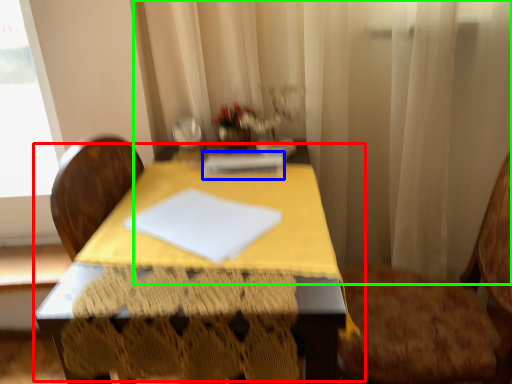
Question: Which object is positioned farthest from table (highlighted by a red box)? Select from notebook (highlighted by a blue box) and curtain (highlighted by a green box).

Choices:
 (A) notebook
 (B) curtain

Answer: (B)